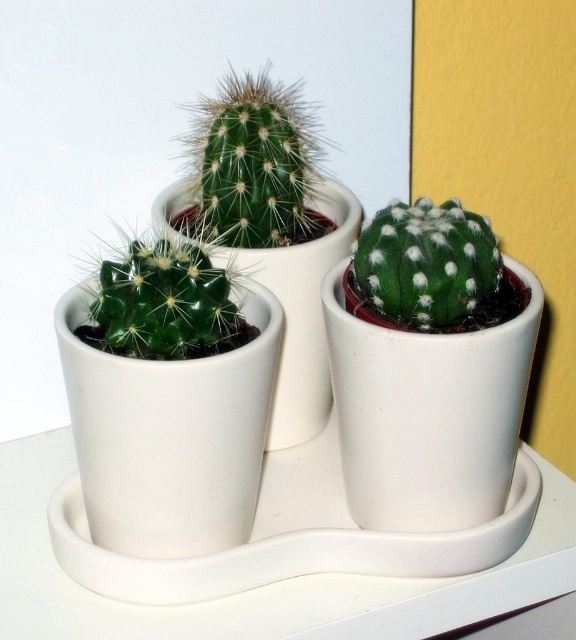
Can you confirm if green spiny cactus at center is positioned above green fuzzy cactus at right?

Indeed, green spiny cactus at center is positioned over green fuzzy cactus at right.

Which is more to the right, green spiny cactus at center or green fuzzy cactus at right?

green fuzzy cactus at right

Does point (255, 216) come behind point (392, 301)?

Yes, it is.

You are a GUI agent. You are given a task and a screenshot of the screen. Output one action in this format:
    pyautogui.click(x=<x>, y=<y>)
    Task: Click on the green spiny cactus at center
    The height and width of the screenshot is (640, 576).
    Given the screenshot: What is the action you would take?
    pyautogui.click(x=252, y=164)

Is green fuzzy cactus at right in front of green matte cactus at center?

No, it is not.

Can you confirm if green fuzzy cactus at right is positioned to the right of green matte cactus at center?

Indeed, green fuzzy cactus at right is positioned on the right side of green matte cactus at center.

Describe the element at coordinates (426, 266) in the screenshot. The height and width of the screenshot is (640, 576). I see `green fuzzy cactus at right` at that location.

This screenshot has height=640, width=576. In order to click on green fuzzy cactus at right in this screenshot , I will do click(x=426, y=266).

Is green spiny cactus at center taller than green matte cactus at center?

Yes.

Does green spiny cactus at center have a larger size compared to green matte cactus at center?

Yes.

Locate an element on the screen. This screenshot has height=640, width=576. green spiny cactus at center is located at coordinates (252, 164).